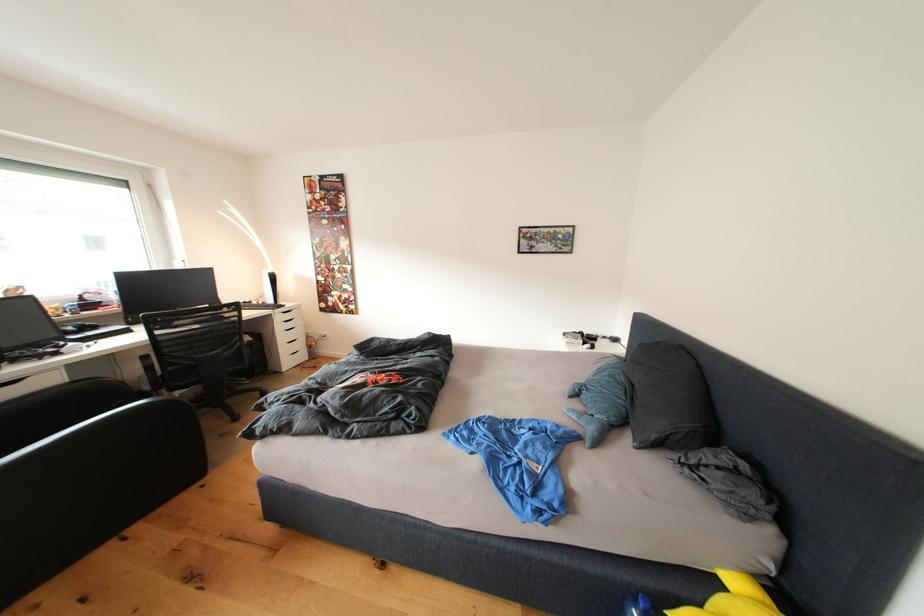
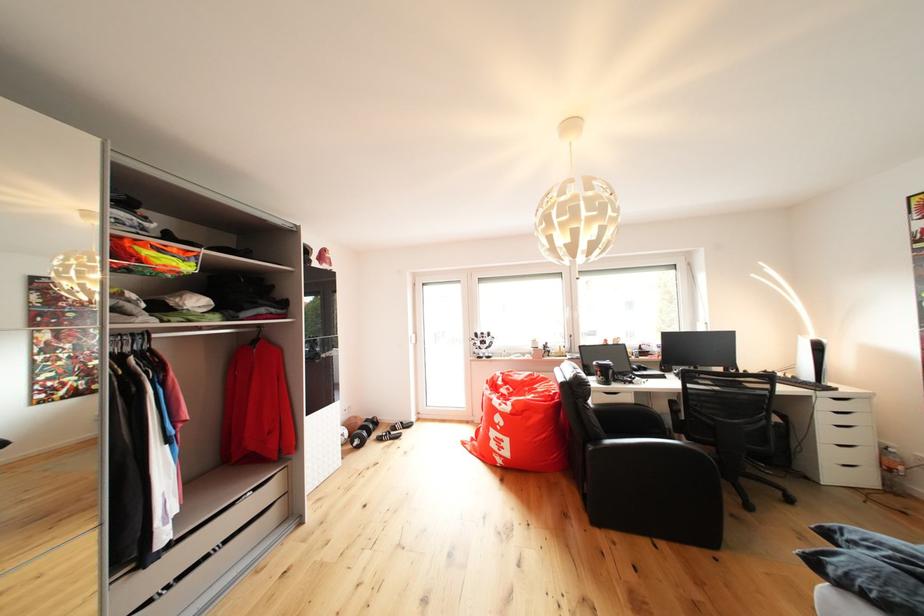
Where in the second image is the point corresponding to (x=298, y=310) from the first image?

(855, 395)